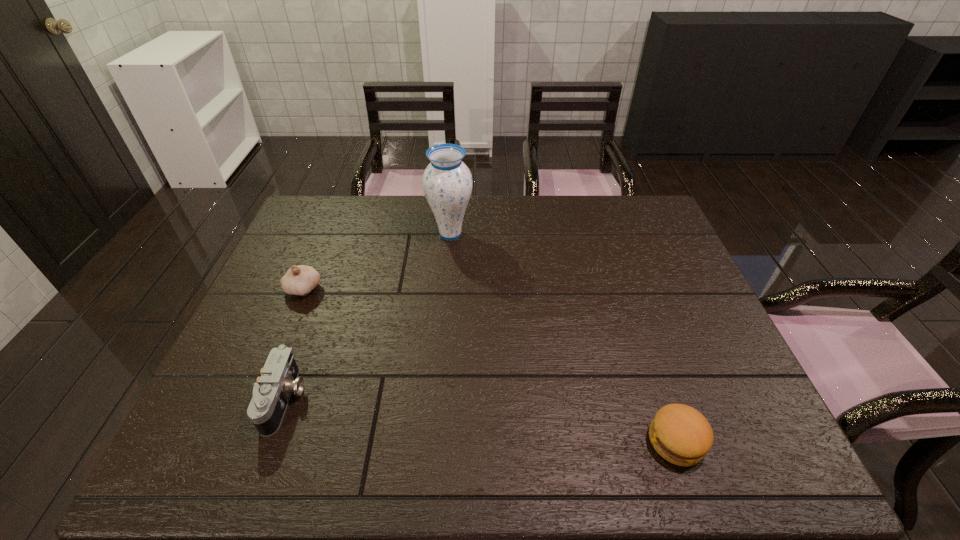
Locate an element on the screen. camera situated at the near edge is located at coordinates (279, 378).

Locate an element on the screen. This screenshot has height=540, width=960. hamburger that is at the near edge is located at coordinates (680, 434).

The width and height of the screenshot is (960, 540). I want to click on garlic that is at the left edge, so click(299, 280).

This screenshot has height=540, width=960. In order to click on camera at the left edge in this screenshot , I will do tap(279, 378).

Locate an element on the screen. This screenshot has height=540, width=960. object that is at the right edge is located at coordinates (680, 434).

Locate an element on the screen. This screenshot has width=960, height=540. object present at the near left corner is located at coordinates (279, 378).

In order to click on object at the near right corner in this screenshot , I will do `click(680, 434)`.

This screenshot has height=540, width=960. I want to click on blank area at the far edge, so click(x=477, y=197).

What are the coordinates of `vacant space at the near edge of the desktop` in the screenshot? It's located at (468, 474).

Where is `free space at the left edge of the desktop`? The width and height of the screenshot is (960, 540). free space at the left edge of the desktop is located at coordinates (320, 266).